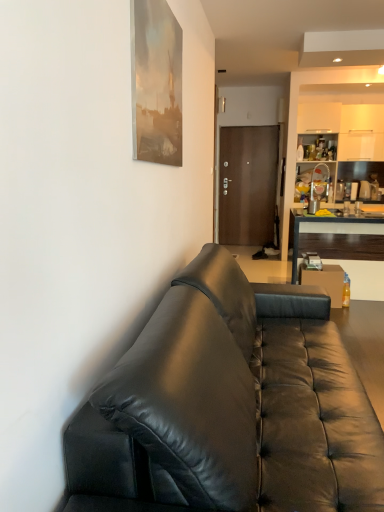
Question: Is brown matte door at center taller than dark wood desk at right?

Choices:
 (A) no
 (B) yes

Answer: (B)

Question: From the image's perspective, is brown matte door at center on dark wood desk at right?

Choices:
 (A) yes
 (B) no

Answer: (A)

Question: Does brown matte door at center appear on the right side of dark wood desk at right?

Choices:
 (A) yes
 (B) no

Answer: (B)

Question: Is dark wood desk at right at the back of brown matte door at center?

Choices:
 (A) yes
 (B) no

Answer: (B)

Question: From a real-world perspective, is brown matte door at center physically below dark wood desk at right?

Choices:
 (A) yes
 (B) no

Answer: (B)

Question: Is brown matte door at center positioned far away from dark wood desk at right?

Choices:
 (A) yes
 (B) no

Answer: (A)

Question: Does translucent plastic bottle at right have a larger size compared to brown matte door at center?

Choices:
 (A) no
 (B) yes

Answer: (A)

Question: Considering the relative positions of translucent plastic bottle at right and brown matte door at center in the image provided, is translucent plastic bottle at right to the right of brown matte door at center from the viewer's perspective?

Choices:
 (A) yes
 (B) no

Answer: (A)

Question: Can you confirm if translucent plastic bottle at right is positioned to the left of brown matte door at center?

Choices:
 (A) no
 (B) yes

Answer: (A)

Question: Is brown matte door at center at the back of translucent plastic bottle at right?

Choices:
 (A) yes
 (B) no

Answer: (B)

Question: Is translucent plastic bottle at right shorter than brown matte door at center?

Choices:
 (A) yes
 (B) no

Answer: (A)

Question: Considering the relative sizes of translucent plastic bottle at right and brown matte door at center in the image provided, is translucent plastic bottle at right thinner than brown matte door at center?

Choices:
 (A) yes
 (B) no

Answer: (B)

Question: Can you confirm if dark wood desk at right is shorter than matte silver cup at center?

Choices:
 (A) no
 (B) yes

Answer: (A)